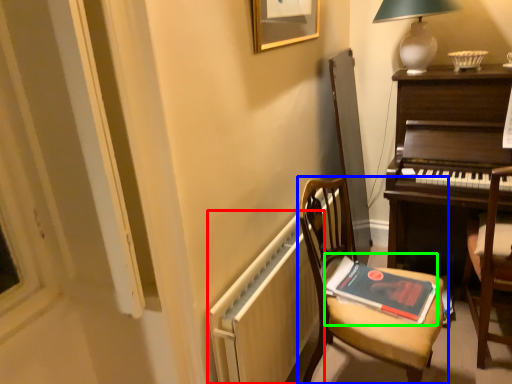
Question: Based on their relative distances, which object is farther from radiator (highlighted by a red box)? Choose from chair (highlighted by a blue box) and paperback book (highlighted by a green box).

Choices:
 (A) chair
 (B) paperback book

Answer: (B)